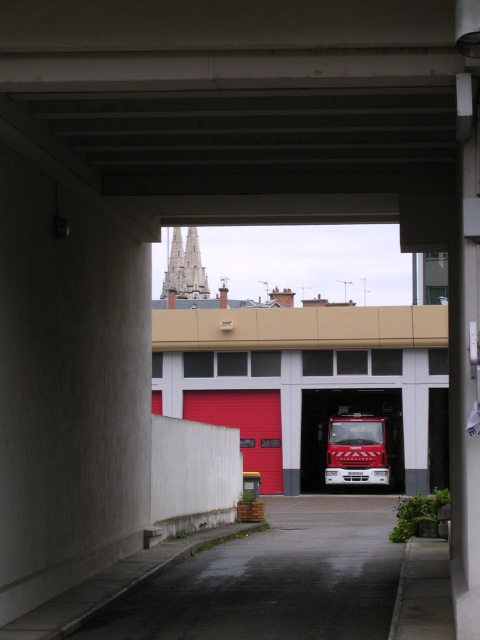
Can you confirm if red matte fire truck at center is bigger than beige concrete overpass at center?

Correct, red matte fire truck at center is larger in size than beige concrete overpass at center.

Is point (334, 353) in front of point (336, 317)?

No, (334, 353) is behind (336, 317).

Between point (398, 460) and point (181, 330), which one is positioned in front?

Point (181, 330) is in front.

Image resolution: width=480 pixels, height=640 pixels. I want to click on red matte fire truck at center, so click(x=309, y=384).

Between beige concrete overpass at center and red metallic fire truck at center, which one is positioned higher?

beige concrete overpass at center is above.

You are a GUI agent. You are given a task and a screenshot of the screen. Output one action in this format:
    pyautogui.click(x=<x>, y=<y>)
    Task: Click on the beige concrete overpass at center
    This screenshot has height=640, width=480.
    Given the screenshot: What is the action you would take?
    pyautogui.click(x=300, y=326)

Based on the photo, which of these two, red matte fire truck at center or red metallic fire truck at center, stands taller?

red matte fire truck at center

Can you confirm if red matte fire truck at center is smaller than red metallic fire truck at center?

Incorrect, red matte fire truck at center is not smaller in size than red metallic fire truck at center.

Between point (201, 400) and point (358, 413), which one is positioned in front?

Point (358, 413)

Locate an element on the screen. red matte fire truck at center is located at coordinates (309, 384).